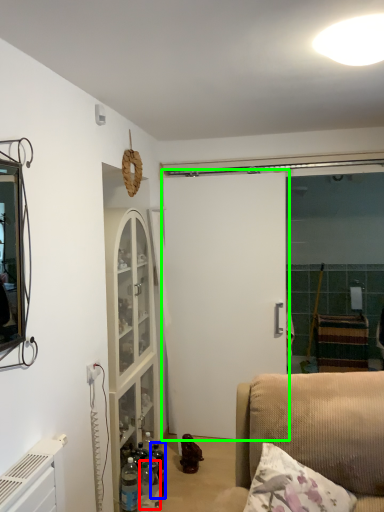
Question: Considering the real-world distances, which object is closest to bottle (highlighted by a red box)? bottle (highlighted by a blue box) or door (highlighted by a green box).

Choices:
 (A) bottle
 (B) door

Answer: (A)